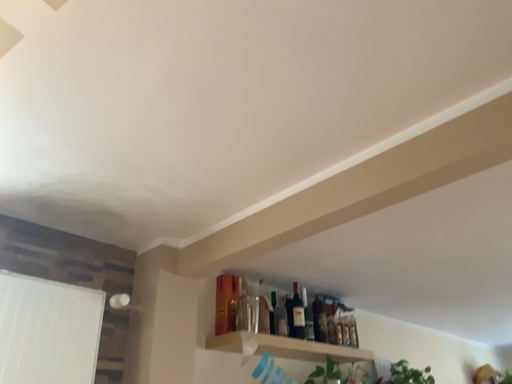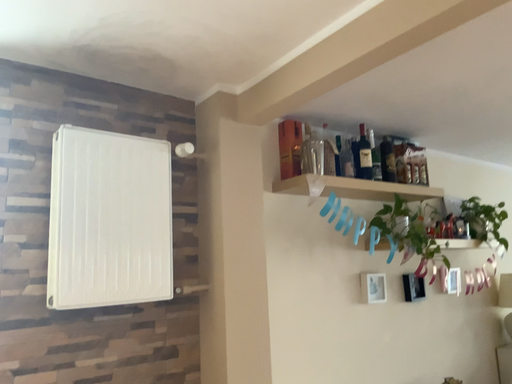
Question: How did the camera likely rotate when shooting the video?

Choices:
 (A) rotated right
 (B) rotated left

Answer: (B)